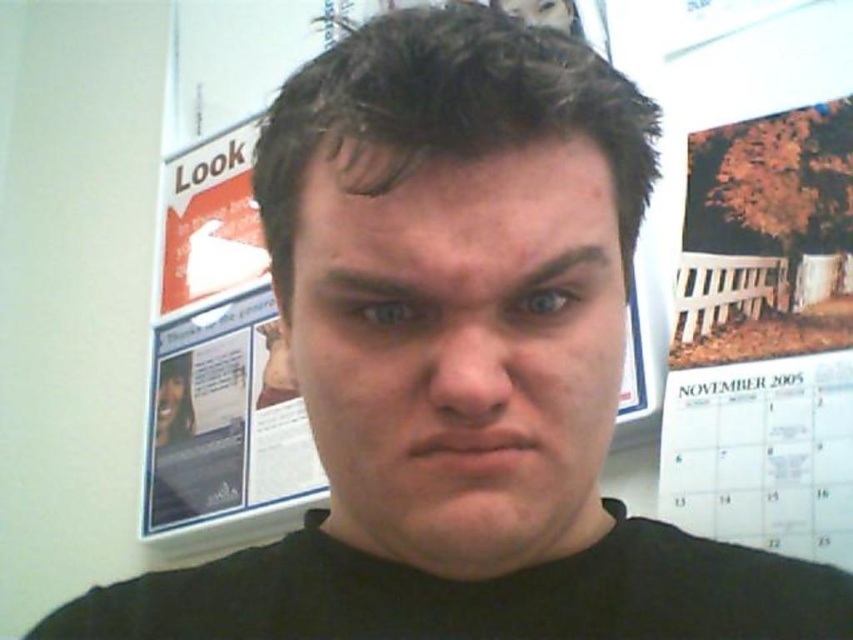
What is the location of the point with coordinates (460,349) in the image?

The point with coordinates (460,349) corresponds to the matte skin face at center.

You are an interior designer assessing a wall in a room. You see the matte skin face at center and the white paper calendar at right. Which object is positioned higher on the wall?

The matte skin face at center is positioned higher on the wall than the white paper calendar at right because it is above it.